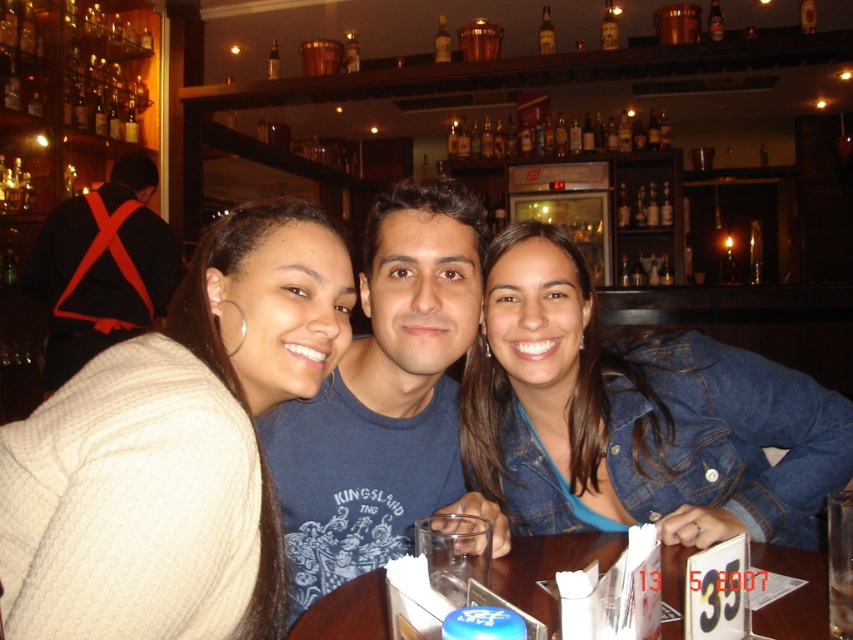
You are a photographer at the bar and want to take a photo of the white knitted sweater at left and the black leather backpack at upper left. Which object is positioned more to the left?

The black leather backpack at upper left is positioned more to the left than the white knitted sweater at left.